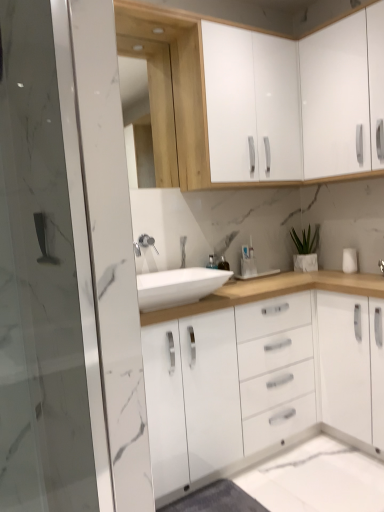
Question: Does white glossy cabinet at upper right, acting as the first cabinetry starting from the right, appear on the left side of white matte plant at upper right?

Choices:
 (A) yes
 (B) no

Answer: (B)

Question: Does white glossy cabinet at upper right, acting as the first cabinetry starting from the right, have a smaller size compared to white matte plant at upper right?

Choices:
 (A) no
 (B) yes

Answer: (A)

Question: Is white glossy cabinet at upper right, which is the second cabinetry from left to right, aimed at white matte plant at upper right?

Choices:
 (A) yes
 (B) no

Answer: (B)

Question: Can you confirm if white glossy cabinet at upper right, acting as the first cabinetry starting from the right, is bigger than white matte plant at upper right?

Choices:
 (A) no
 (B) yes

Answer: (B)

Question: From the image's perspective, does white glossy cabinet at upper right, acting as the first cabinetry starting from the right, appear higher than white matte plant at upper right?

Choices:
 (A) no
 (B) yes

Answer: (B)

Question: Which is correct: white glossy sink at center is inside white glossy cabinet at upper center, the 2th cabinetry in the right-to-left sequence, or outside of it?

Choices:
 (A) inside
 (B) outside

Answer: (B)

Question: Is white glossy sink at center taller or shorter than white glossy cabinet at upper center, the 1th cabinetry in the left-to-right sequence?

Choices:
 (A) short
 (B) tall

Answer: (A)

Question: Based on their positions, is white glossy sink at center located to the left or right of white glossy cabinet at upper center, the 1th cabinetry in the left-to-right sequence?

Choices:
 (A) right
 (B) left

Answer: (B)

Question: In terms of size, does white glossy sink at center appear bigger or smaller than white glossy cabinet at upper center, the 1th cabinetry in the left-to-right sequence?

Choices:
 (A) small
 (B) big

Answer: (A)

Question: Which is correct: white glossy sink at center is inside satin nickel faucet at center, or outside of it?

Choices:
 (A) outside
 (B) inside

Answer: (A)

Question: Considering their positions, is white glossy sink at center located in front of or behind satin nickel faucet at center?

Choices:
 (A) behind
 (B) front

Answer: (B)

Question: Is white glossy sink at center to the left or to the right of satin nickel faucet at center in the image?

Choices:
 (A) right
 (B) left

Answer: (A)

Question: From a real-world perspective, is white glossy sink at center above or below satin nickel faucet at center?

Choices:
 (A) above
 (B) below

Answer: (B)

Question: Looking at their shapes, would you say white glossy cabinet at upper center, the 1th cabinetry in the left-to-right sequence, is wider or thinner than satin nickel faucet at center?

Choices:
 (A) thin
 (B) wide

Answer: (B)

Question: Is white glossy cabinet at upper center, the 1th cabinetry in the left-to-right sequence, taller or shorter than satin nickel faucet at center?

Choices:
 (A) short
 (B) tall

Answer: (B)